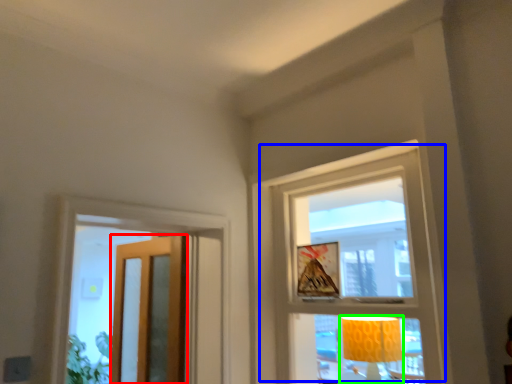
Question: Considering the real-world distances, which object is closest to door (highlighted by a red box)? window (highlighted by a blue box) or table lamp (highlighted by a green box).

Choices:
 (A) window
 (B) table lamp

Answer: (A)